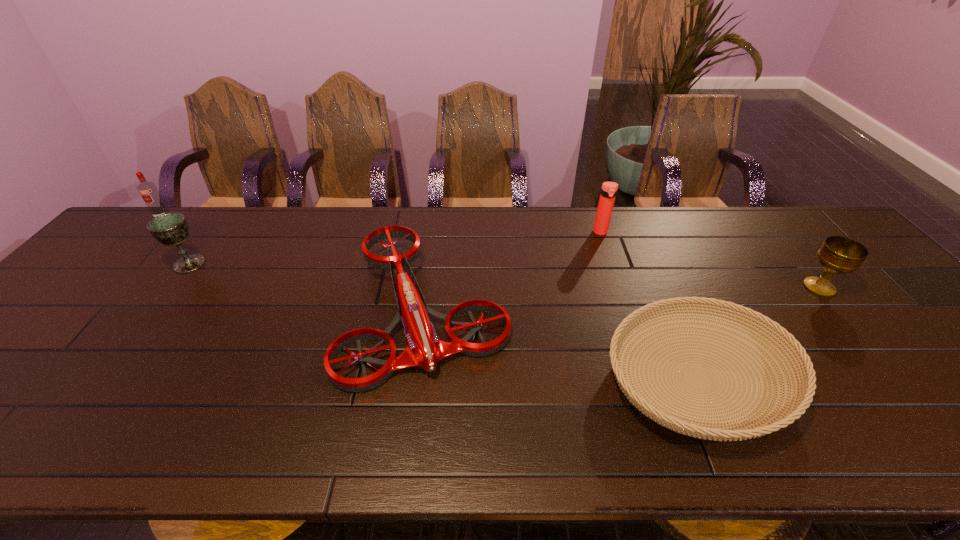
This screenshot has height=540, width=960. Identify the location of object that is positioned at the left edge. (148, 190).

You are a GUI agent. You are given a task and a screenshot of the screen. Output one action in this format:
    pyautogui.click(x=<x>, y=<y>)
    Task: Click on the object present at the right edge
    The width and height of the screenshot is (960, 540).
    Given the screenshot: What is the action you would take?
    pyautogui.click(x=838, y=255)

Where is `object at the far left corner`? Image resolution: width=960 pixels, height=540 pixels. object at the far left corner is located at coordinates (148, 190).

This screenshot has height=540, width=960. Find the location of `vacant space at the far edge of the desktop`. vacant space at the far edge of the desktop is located at coordinates (640, 237).

In the image, there is a desktop. Where is `blank space at the near edge`? This screenshot has height=540, width=960. blank space at the near edge is located at coordinates (959, 455).

At what (x,y) coordinates should I click in order to perform the action: click on free spot at the left edge of the desktop. Please return your answer as a coordinate pair (x, y). This screenshot has width=960, height=540. Looking at the image, I should click on (34, 374).

Locate an element on the screen. free space at the far left corner of the desktop is located at coordinates (155, 242).

You are a GUI agent. You are given a task and a screenshot of the screen. Output one action in this format:
    pyautogui.click(x=<x>, y=<y>)
    Task: Click on the free spot between the second shortest object and the nearer chalice
    Image resolution: width=960 pixels, height=540 pixels.
    Given the screenshot: What is the action you would take?
    pyautogui.click(x=623, y=298)

Image resolution: width=960 pixels, height=540 pixels. I want to click on free spot between the farthest object and the basket, so click(x=430, y=298).

Locate an element on the screen. The height and width of the screenshot is (540, 960). vacant point located between the basket and the farther chalice is located at coordinates (444, 322).